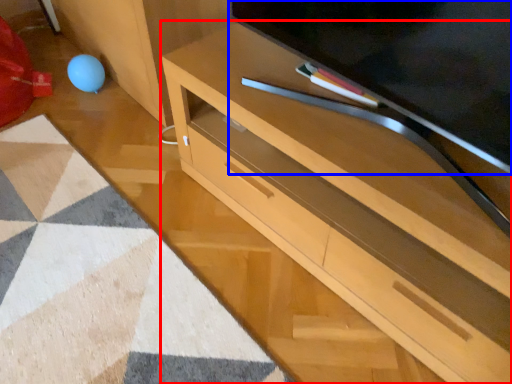
Question: Which object appears farthest to the camera in this image, desk (highlighted by a red box) or television (highlighted by a blue box)?

Choices:
 (A) desk
 (B) television

Answer: (A)